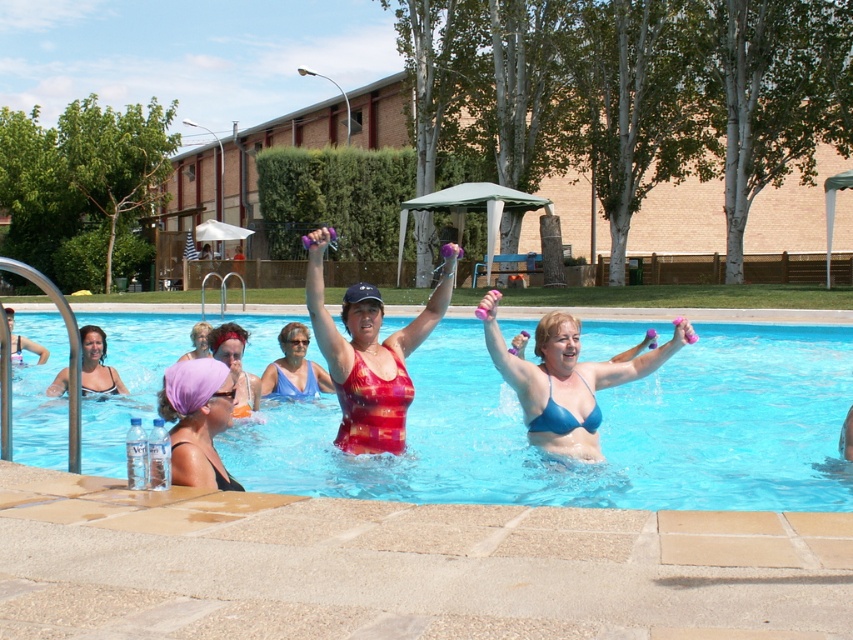
In the scene shown: You are a photographer taking a picture of the blue bikini at center and the purple fabric headscarf at center. Which object should you focus on first if you want to capture both in the same frame without moving the camera?

The blue bikini at center has a greater height compared to the purple fabric headscarf at center, so you should focus on the blue bikini at center first as it is taller and will occupy more of the frame.

You are a photographer standing at the edge of the pool. You want to take a photo that includes both the blue bikini at center and the transparent plastic goggles at upper center. The camera you are using has a maximum focus range of 2 meters. Will you be able to capture both subjects in focus without moving your position?

The distance between the blue bikini at center and the transparent plastic goggles at upper center is 2.20 meters. Since the camera can only focus within 2 meters, the subjects are slightly out of the focus range. You might need to adjust your position or use a different camera setting to ensure both are in focus.

You are a photographer trying to capture a clear shot of both the purple fabric headscarf at upper left and the purple fabric headscarf at center. However, you notice one is blocking the view of the other. Which headscarf is obscuring the other?

The purple fabric headscarf at upper left is in front of the purple fabric headscarf at center, so it is blocking the view of the one at center.